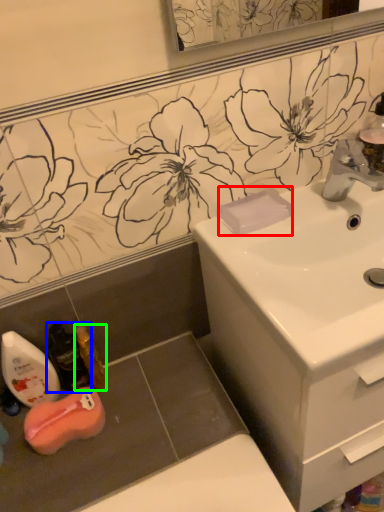
Question: Which is nearer to the soap (highlighted by a red box)? mouthwash (highlighted by a blue box) or mouthwash (highlighted by a green box).

Choices:
 (A) mouthwash
 (B) mouthwash

Answer: (B)